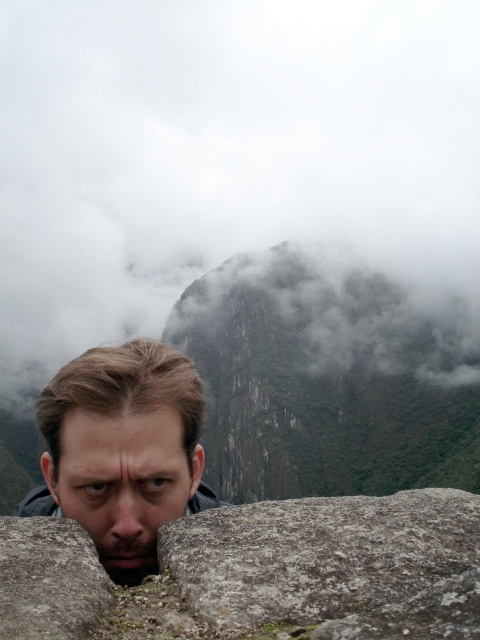
Can you confirm if rocky cliff at center is bigger than gray rough rock at center?

Yes.

Which is more to the left, rocky cliff at center or gray rough rock at center?

From the viewer's perspective, rocky cliff at center appears more on the left side.

Which is in front, point (262, 346) or point (236, 604)?

Positioned in front is point (236, 604).

At what (x,y) coordinates should I click in order to perform the action: click on rocky cliff at center. Please return your answer as a coordinate pair (x, y). Looking at the image, I should click on (324, 384).

Does cloudy mist at upper center have a larger size compared to gray rough stone at lower left?

Correct, cloudy mist at upper center is larger in size than gray rough stone at lower left.

Is cloudy mist at upper center closer to the viewer compared to gray rough stone at lower left?

No, cloudy mist at upper center is behind gray rough stone at lower left.

Is point (361, 252) positioned after point (2, 572)?

Yes, it is.

This screenshot has width=480, height=640. I want to click on cloudy mist at upper center, so click(226, 154).

Can you confirm if gray rough rock at center is positioned below gray rough stone at lower left?

Incorrect, gray rough rock at center is not positioned below gray rough stone at lower left.

I want to click on gray rough rock at center, so click(319, 554).

Locate an element on the screen. This screenshot has width=480, height=640. gray rough rock at center is located at coordinates (319, 554).